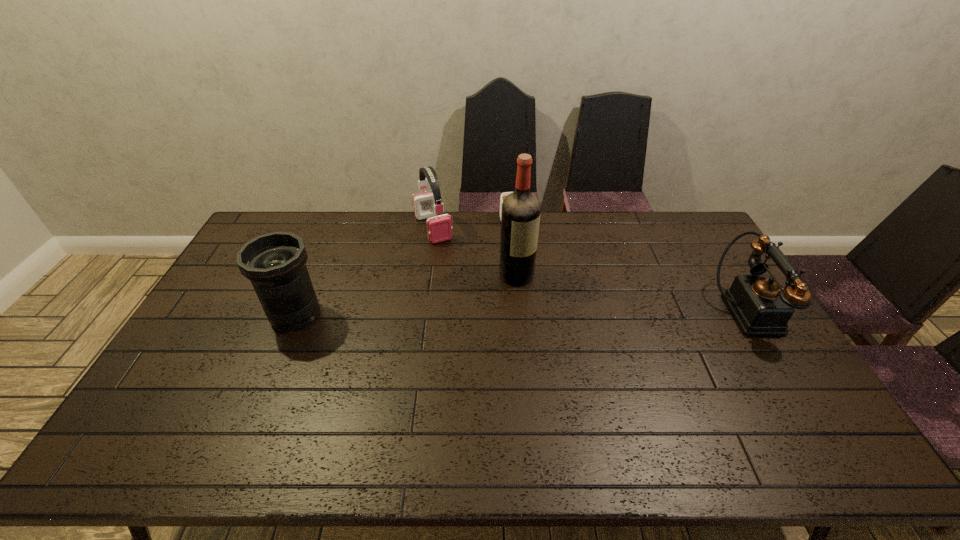
At what (x,y) coordinates should I click in order to perform the action: click on empty space between the telephoto lens and the second object from left to right. Please return your answer as a coordinate pair (x, y). The image size is (960, 540). Looking at the image, I should click on (364, 271).

Identify which object is located as the nearest to the liquor. Please provide its 2D coordinates. Your answer should be formatted as a tuple, i.e. [(x, y)], where the tuple contains the x and y coordinates of a point satisfying the conditions above.

[(503, 195)]

Select which object is the third closest to the cup. Please provide its 2D coordinates. Your answer should be formatted as a tuple, i.e. [(x, y)], where the tuple contains the x and y coordinates of a point satisfying the conditions above.

[(761, 306)]

You are a GUI agent. You are given a task and a screenshot of the screen. Output one action in this format:
    pyautogui.click(x=<x>, y=<y>)
    Task: Click on the free space that satisfies the following two spatial constraints: 1. on the back side of the telephone; 2. on the front of the telephoto lens at the rotary dial
    The width and height of the screenshot is (960, 540).
    Given the screenshot: What is the action you would take?
    pyautogui.click(x=297, y=312)

Where is `free region that satisfies the following two spatial constraints: 1. on the back side of the second object from left to right; 2. on the right side of the telephoto lens`? This screenshot has height=540, width=960. free region that satisfies the following two spatial constraints: 1. on the back side of the second object from left to right; 2. on the right side of the telephoto lens is located at coordinates (331, 228).

You are a GUI agent. You are given a task and a screenshot of the screen. Output one action in this format:
    pyautogui.click(x=<x>, y=<y>)
    Task: Click on the vacant space that satisfies the following two spatial constraints: 1. on the front side of the telephone; 2. on the front of the cup at the rotary dial
    The image size is (960, 540).
    Given the screenshot: What is the action you would take?
    pyautogui.click(x=521, y=312)